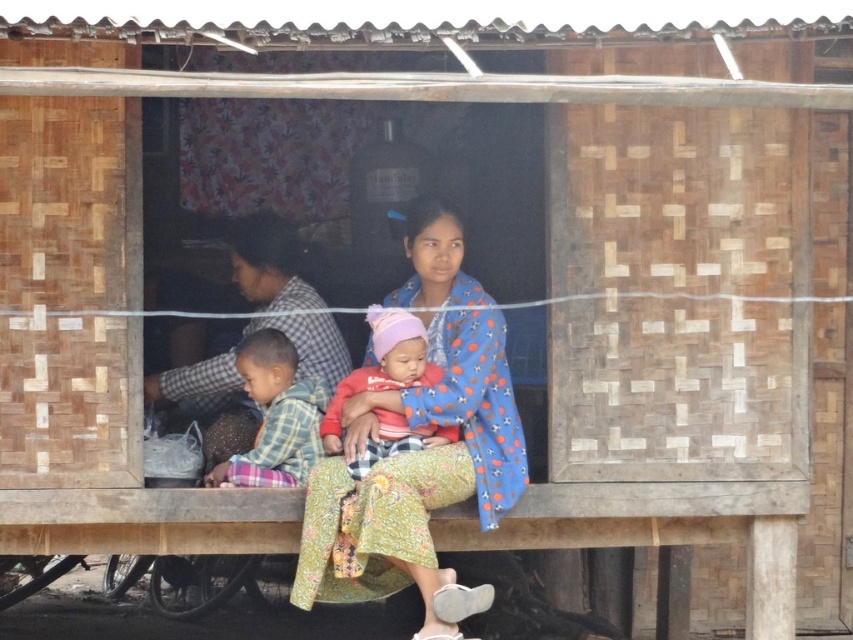
You are standing at the entrance of the wooden structure and want to greet the person wearing the floral fabric dress at center. Which direction should you walk to reach them?

The floral fabric dress at center is located at point 0.672 on the x axis and 0.492 on the y axis. Since you are at the entrance, which is likely at the front of the structure, you should walk forward towards the center area where the dress is positioned.

You are standing at the entrance of the wooden structure and want to find the floral fabric dress at center. Which direction should you look to locate it?

The floral fabric dress at center is located at the center of the image, so you should look straight ahead to find it.